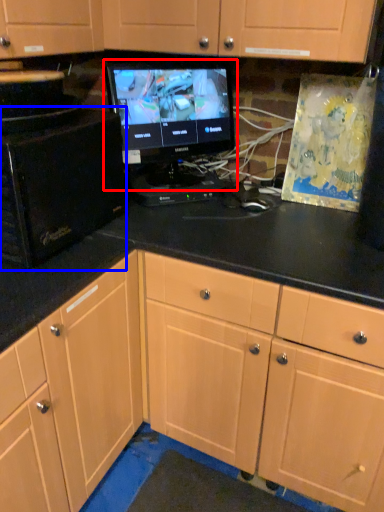
Question: Which point is closer to the camera, computer monitor (highlighted by a red box) or desktop computer (highlighted by a blue box)?

Choices:
 (A) computer monitor
 (B) desktop computer

Answer: (B)